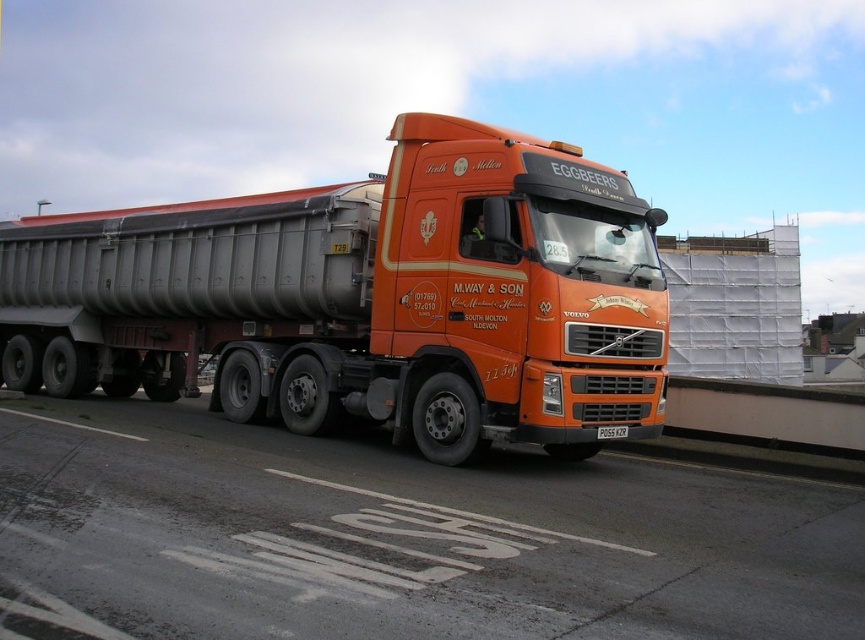
What are the coordinates of the orange matte truck at center?

The orange matte truck at center is located at coordinates point (367,298).

You are a photographer trying to capture the orange metallic truck at center and the orange matte truck at center in a single shot. Since you want both trucks to be fully visible, which truck should you position closer to the edge of the frame to avoid cropping?

To ensure both the orange metallic truck at center and the orange matte truck at center are fully visible in the frame, you should position the orange metallic truck at center closer to the edge of the frame. This is because it is located on the right side of the orange matte truck at center, so moving it toward the edge will prevent cropping while keeping the matte truck centered.